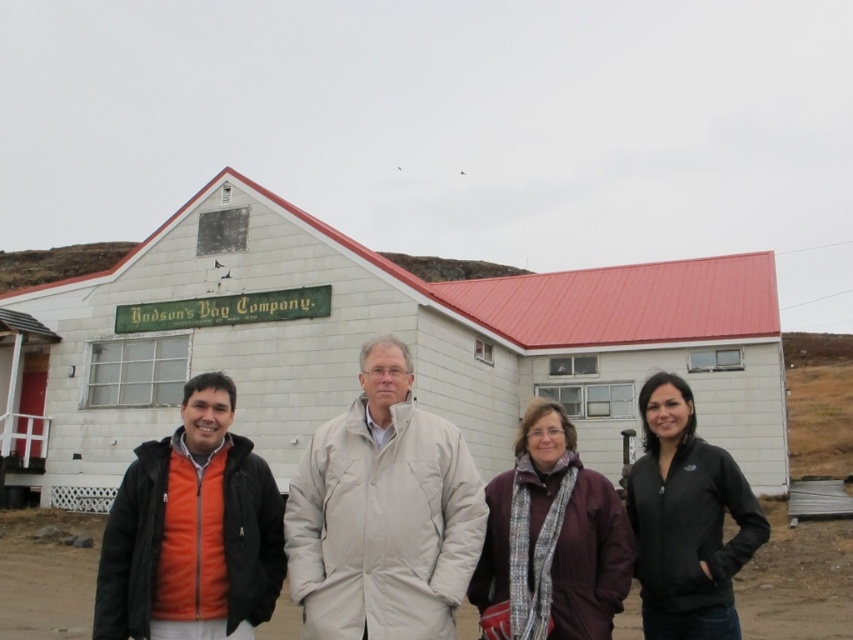
Question: Among these objects, which one is nearest to the camera?

Choices:
 (A) black softshell jacket at right
 (B) purple woolen scarf at center
 (C) white brick building at center

Answer: (B)

Question: Is beige fabric coat at center to the left of orange fleece at left from the viewer's perspective?

Choices:
 (A) no
 (B) yes

Answer: (A)

Question: Does orange fleece jacket at lower left have a greater width compared to black softshell jacket at right?

Choices:
 (A) no
 (B) yes

Answer: (B)

Question: Considering the real-world distances, which object is farthest from the orange fleece jacket at lower left?

Choices:
 (A) purple woolen scarf at center
 (B) white brick building at center
 (C) black softshell jacket at right
 (D) beige fabric coat at center

Answer: (B)

Question: Among these objects, which one is nearest to the camera?

Choices:
 (A) orange fleece jacket at lower left
 (B) white brick building at center
 (C) purple woolen scarf at center
 (D) black softshell jacket at right

Answer: (A)

Question: From the image, what is the correct spatial relationship of white brick building at center in relation to black softshell jacket at right?

Choices:
 (A) left
 (B) right

Answer: (A)